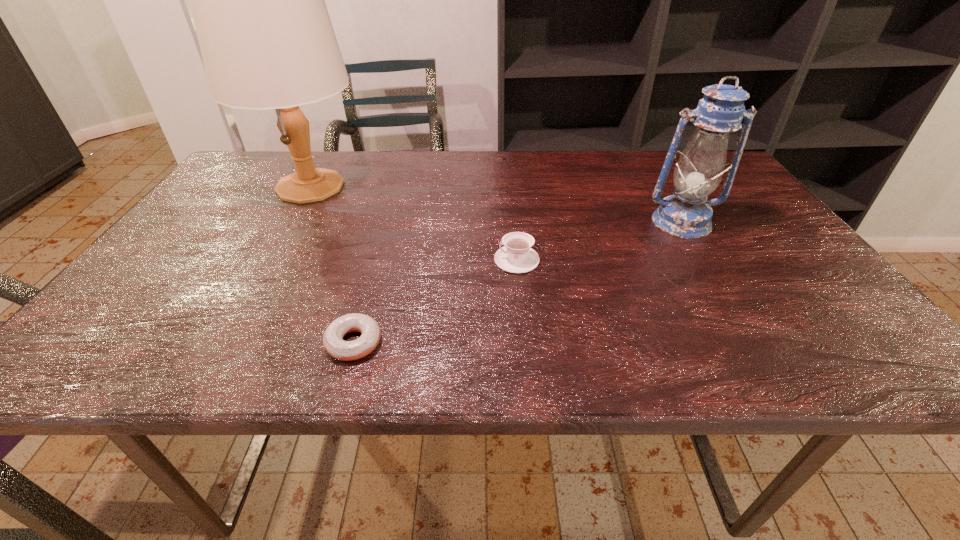
This screenshot has height=540, width=960. I want to click on free space located on the handle side of the third tallest object, so click(x=342, y=260).

Identify the location of vacant space located 0.350m on the handle side of the third tallest object. (338, 260).

Find the location of `vacant space situated 0.240m on the handle side of the third tallest object`. vacant space situated 0.240m on the handle side of the third tallest object is located at coordinates (387, 260).

Find the location of a particular element. This screenshot has width=960, height=540. blank space located 0.340m on the left of the nearest object is located at coordinates (139, 342).

Image resolution: width=960 pixels, height=540 pixels. In order to click on object positioned at the far edge in this screenshot , I will do 267,42.

Image resolution: width=960 pixels, height=540 pixels. Find the location of `object situated at the near edge`. object situated at the near edge is located at coordinates (333, 342).

This screenshot has width=960, height=540. Identify the location of object situated at the left edge. (267, 42).

Identify the location of object that is at the right edge. 687,214.

The image size is (960, 540). In order to click on object present at the far left corner in this screenshot , I will do `click(267, 42)`.

I want to click on free region at the far edge of the desktop, so click(567, 156).